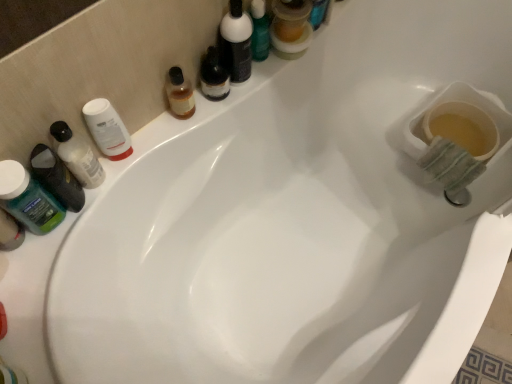
Question: From the image's perspective, is translucent amber liquid at upper center, the 4th mouthwash when ordered from left to right, above or below matte black bottle at upper center, the first toiletry in the right-to-left sequence?

Choices:
 (A) below
 (B) above

Answer: (A)

Question: Looking at the image, does translucent amber liquid at upper center, the 2th mouthwash viewed from the right, seem bigger or smaller compared to matte black bottle at upper center, the first toiletry in the right-to-left sequence?

Choices:
 (A) big
 (B) small

Answer: (B)

Question: Which object is positioned closest to the green opaque plastic mouthwash at left, which is counted as the fifth mouthwash, starting from the right?

Choices:
 (A) translucent plastic bottle at left, which is the 1th toiletry from bottom to top
 (B) translucent plastic mouthwash at upper center, which appears as the 5th mouthwash when viewed from the left
 (C) matte black bottle at upper center, which appears as the first toiletry when viewed from the top
 (D) translucent amber liquid at upper center, the 2th mouthwash viewed from the right
 (E) white matte jar at upper left, the 3th mouthwash positioned from the right

Answer: (A)

Question: Which is farther from the translucent plastic bottle at left, acting as the 2th toiletry starting from the top?

Choices:
 (A) translucent amber liquid at upper center, the 4th mouthwash when ordered from left to right
 (B) translucent plastic mouthwash at left, acting as the 2th mouthwash starting from the left
 (C) green opaque plastic mouthwash at left, acting as the 1th mouthwash starting from the left
 (D) translucent plastic mouthwash at upper center, positioned as the first mouthwash in right-to-left order
 (E) white matte jar at upper left, which appears as the 3th mouthwash when viewed from the left

Answer: (D)